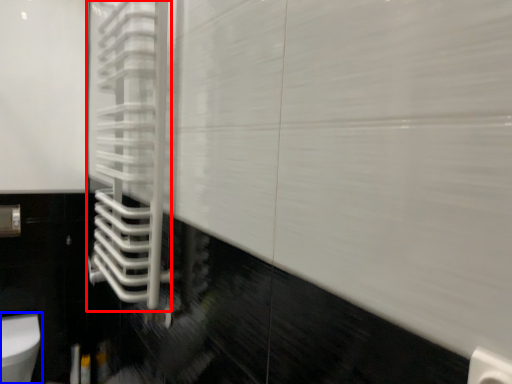
Question: Which of the following is the farthest to the observer, shower door (highlighted by a red box) or toilet (highlighted by a blue box)?

Choices:
 (A) shower door
 (B) toilet

Answer: (B)